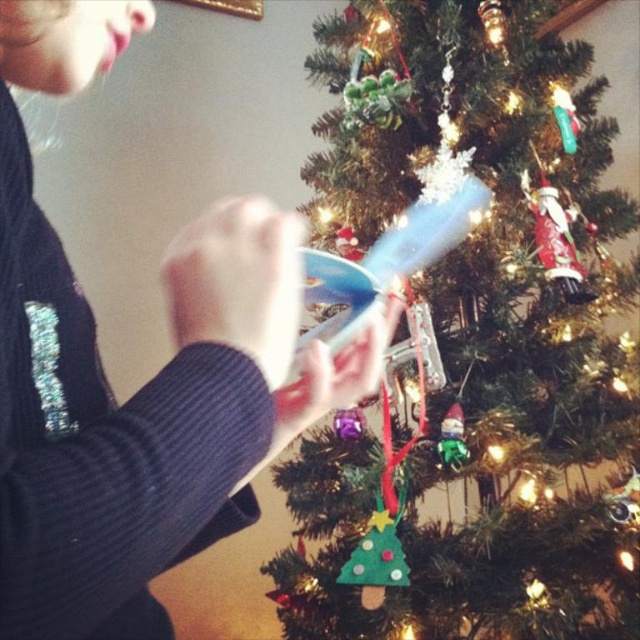
Question: Which point is farther to the camera?

Choices:
 (A) (570, 211)
 (B) (342, 170)
 (C) (444, 426)

Answer: (B)

Question: Can you confirm if green felt ornament at center is smaller than dark blue sweater at upper left?

Choices:
 (A) yes
 (B) no

Answer: (B)

Question: Where is dark blue sweater at upper left located in relation to green felt gnome at lower center in the image?

Choices:
 (A) right
 (B) left

Answer: (B)

Question: Can you confirm if green felt ornament at center is bigger than green felt gnome at lower center?

Choices:
 (A) no
 (B) yes

Answer: (B)

Question: Which point is farther to the camera?

Choices:
 (A) (609, 348)
 (B) (534, 195)

Answer: (A)

Question: Which point is closer to the camera?

Choices:
 (A) (570, 298)
 (B) (442, 445)

Answer: (B)